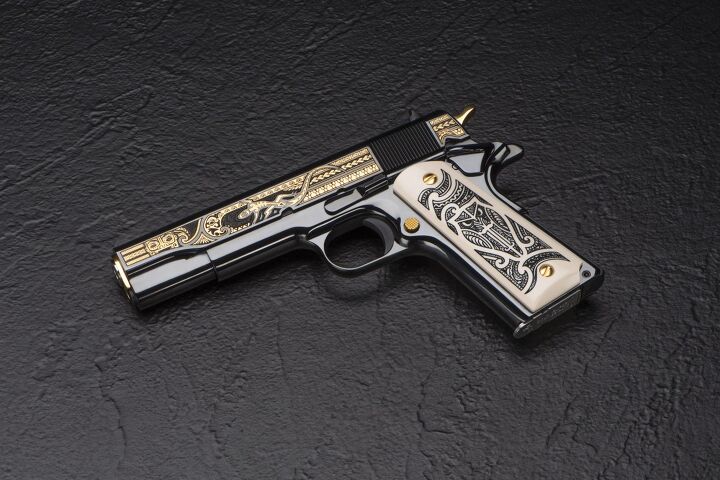
Find the location of a particular element. This screenshot has height=480, width=720. gold screws is located at coordinates (546, 271), (428, 181).